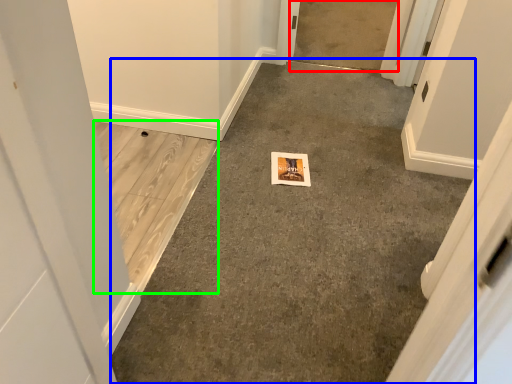
Question: Which object is the closest to the concrete (highlighted by a red box)? Choose among these: concrete (highlighted by a blue box) or concrete (highlighted by a green box).

Choices:
 (A) concrete
 (B) concrete

Answer: (A)